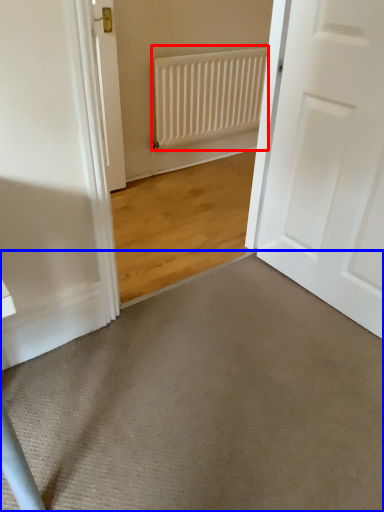
Question: Which point is further to the camera, radiator (highlighted by a red box) or doormat (highlighted by a blue box)?

Choices:
 (A) radiator
 (B) doormat

Answer: (A)